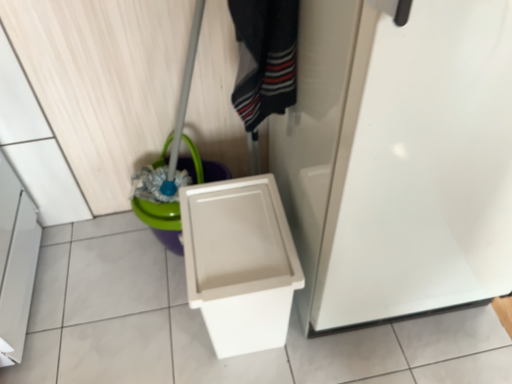
In order to face striped cotton socks at center, should I rotate leftwards or rightwards?

It's best to rotate right around 0.241 degrees.

This screenshot has height=384, width=512. What do you see at coordinates (161, 222) in the screenshot?
I see `green plastic bucket at lower left` at bounding box center [161, 222].

Where is `striped cotton socks at center`? striped cotton socks at center is located at coordinates (265, 58).

Identify the location of potty on the left of the white plastic toilet at lower right. This screenshot has height=384, width=512. (161, 222).

From the image's perspective, relative to green plastic bucket at lower left, is white plastic toilet at lower right above or below?

Clearly, from the image's perspective, white plastic toilet at lower right is below green plastic bucket at lower left.

Can you confirm if white plastic toilet at lower right is positioned to the right of green plastic bucket at lower left?

Yes, white plastic toilet at lower right is to the right of green plastic bucket at lower left.

Does white plastic toilet at lower right have a greater height compared to green plastic bucket at lower left?

Indeed, white plastic toilet at lower right has a greater height compared to green plastic bucket at lower left.

Is striped cotton socks at center oriented towards green plastic bucket at lower left?

No, striped cotton socks at center does not turn towards green plastic bucket at lower left.

From the image's perspective, does striped cotton socks at center appear lower than green plastic bucket at lower left?

Actually, striped cotton socks at center appears above green plastic bucket at lower left in the image.

Visually, is striped cotton socks at center positioned to the left or to the right of green plastic bucket at lower left?

striped cotton socks at center is positioned on green plastic bucket at lower left's right side.

Measure the distance from striped cotton socks at center to green plastic bucket at lower left.

A distance of 18.86 inches exists between striped cotton socks at center and green plastic bucket at lower left.

From a real-world perspective, is green plastic bucket at lower left above or below white plastic toilet at lower right?

From a real-world perspective, green plastic bucket at lower left is physically below white plastic toilet at lower right.

How distant is green plastic bucket at lower left from white plastic toilet at lower right?

11.58 inches.

Is green plastic bucket at lower left aimed at white plastic toilet at lower right?

Yes, green plastic bucket at lower left faces towards white plastic toilet at lower right.

From the image's perspective, is green plastic bucket at lower left over white plastic toilet at lower right?

Correct, green plastic bucket at lower left appears higher than white plastic toilet at lower right in the image.

Is white plastic toilet at lower right located within white glossy screen door at center?

That's incorrect, white plastic toilet at lower right is not inside white glossy screen door at center.

Between white glossy screen door at center and white plastic toilet at lower right, which one has larger size?

white glossy screen door at center.

Is point (442, 84) less distant than point (228, 330)?

Yes, point (442, 84) is closer to viewer.

Measure the distance between white glossy screen door at center and white plastic toilet at lower right.

A distance of 11.35 inches exists between white glossy screen door at center and white plastic toilet at lower right.

Between white plastic toilet at lower right and striped cotton socks at center, which one is positioned in front?

Positioned in front is striped cotton socks at center.

From the image's perspective, would you say white plastic toilet at lower right is positioned over striped cotton socks at center?

No.

Considering the relative positions of white plastic toilet at lower right and striped cotton socks at center in the image provided, is white plastic toilet at lower right to the right of striped cotton socks at center from the viewer's perspective?

Incorrect, white plastic toilet at lower right is not on the right side of striped cotton socks at center.

Could you tell me if white plastic toilet at lower right is facing striped cotton socks at center?

No, white plastic toilet at lower right does not turn towards striped cotton socks at center.

Based on the photo, are green plastic bucket at lower left and striped cotton socks at center far apart?

No, there isn't a large distance between green plastic bucket at lower left and striped cotton socks at center.

Does point (226, 175) come closer to viewer compared to point (293, 26)?

No, (226, 175) is behind (293, 26).

Is green plastic bucket at lower left looking in the opposite direction of striped cotton socks at center?

No, striped cotton socks at center is not at the back of green plastic bucket at lower left.

At what (x,y) coordinates should I click in order to perform the action: click on potty that appears on the left of striped cotton socks at center. Please return your answer as a coordinate pair (x, y). This screenshot has width=512, height=384. Looking at the image, I should click on (161, 222).

Is white glossy screen door at center located outside striped cotton socks at center?

Yes, white glossy screen door at center is located beyond the bounds of striped cotton socks at center.

Can you see white glossy screen door at center touching striped cotton socks at center?

There is a gap between white glossy screen door at center and striped cotton socks at center.

In terms of height, does white glossy screen door at center look taller or shorter compared to striped cotton socks at center?

Clearly, white glossy screen door at center is taller compared to striped cotton socks at center.

Is white glossy screen door at center oriented towards striped cotton socks at center?

No, white glossy screen door at center is not oriented towards striped cotton socks at center.

The image size is (512, 384). Find the location of `toilet lying below the green plastic bucket at lower left (from the image's perspective)`. toilet lying below the green plastic bucket at lower left (from the image's perspective) is located at coordinates (240, 262).

Locate an element on the screen. The image size is (512, 384). potty that appears on the left of striped cotton socks at center is located at coordinates (161, 222).

Looking at the image, which one is located further to white plastic toilet at lower right, white glossy screen door at center or green plastic bucket at lower left?

green plastic bucket at lower left is further to white plastic toilet at lower right.

When comparing their distances from white glossy screen door at center, does white plastic toilet at lower right or green plastic bucket at lower left seem further?

green plastic bucket at lower left is positioned further to the anchor white glossy screen door at center.

Considering their positions, is white plastic toilet at lower right positioned closer to green plastic bucket at lower left than striped cotton socks at center?

The object closer to green plastic bucket at lower left is white plastic toilet at lower right.

From the image, which object appears to be farther from striped cotton socks at center, green plastic bucket at lower left or white glossy screen door at center?

green plastic bucket at lower left.

Estimate the real-world distances between objects in this image. Which object is further from white glossy screen door at center, white plastic toilet at lower right or striped cotton socks at center?

Based on the image, striped cotton socks at center appears to be further to white glossy screen door at center.

Looking at the image, which one is located closer to striped cotton socks at center, green plastic bucket at lower left or white plastic toilet at lower right?

The object closer to striped cotton socks at center is white plastic toilet at lower right.

Considering their positions, is white glossy screen door at center positioned closer to striped cotton socks at center than white plastic toilet at lower right?

The object closer to striped cotton socks at center is white glossy screen door at center.

When comparing their distances from white plastic toilet at lower right, does white glossy screen door at center or striped cotton socks at center seem further?

striped cotton socks at center.

In order to click on screen door between striped cotton socks at center and white plastic toilet at lower right vertically in this screenshot , I will do `click(421, 166)`.

Identify the location of potty between striped cotton socks at center and white plastic toilet at lower right vertically. This screenshot has height=384, width=512. (161, 222).

Image resolution: width=512 pixels, height=384 pixels. Find the location of `toilet positioned between white glossy screen door at center and green plastic bucket at lower left from near to far`. toilet positioned between white glossy screen door at center and green plastic bucket at lower left from near to far is located at coordinates (240, 262).

Where is `clothing between white glossy screen door at center and green plastic bucket at lower left in the front-back direction`? clothing between white glossy screen door at center and green plastic bucket at lower left in the front-back direction is located at coordinates (265, 58).